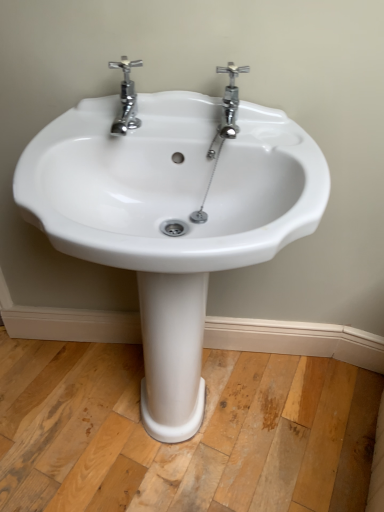
The height and width of the screenshot is (512, 384). In order to click on vacant space to the right of chrome/metallic faucet at upper left, the first tap from the left in this screenshot , I will do (195, 128).